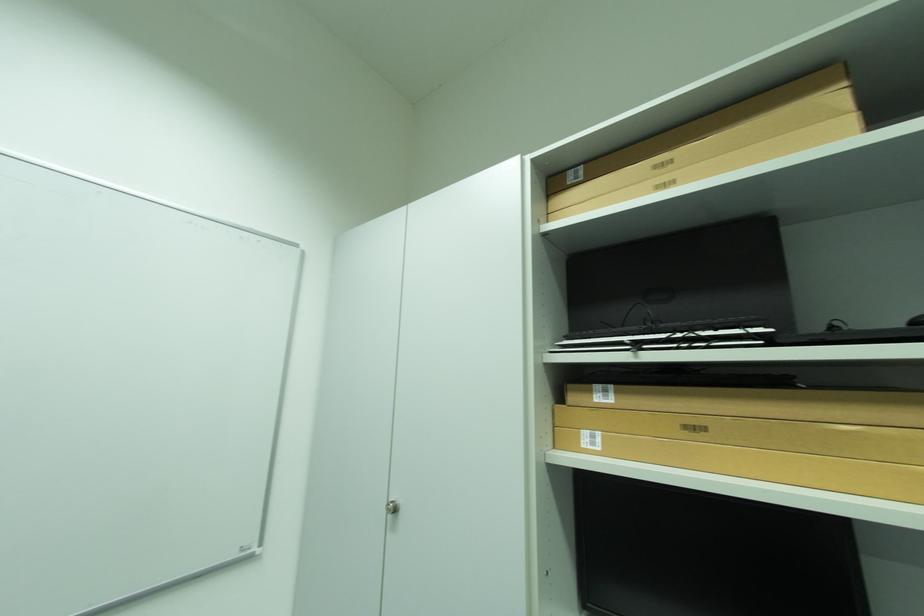
The height and width of the screenshot is (616, 924). Find the location of `cabinet door lock`. cabinet door lock is located at coordinates (392, 507).